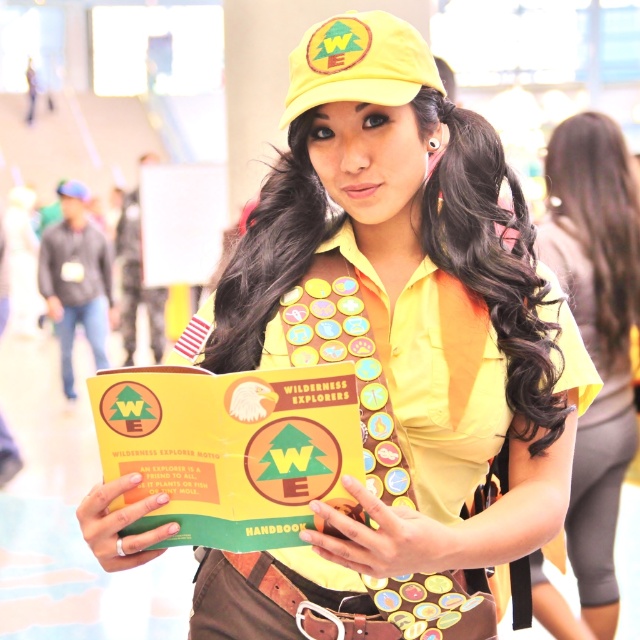
Based on the photo, measure the distance between yellow fabric cap at upper center and camera.

A distance of 2.72 meters exists between yellow fabric cap at upper center and camera.

Is yellow fabric cap at upper center above yellow fabric hat at upper center?

No, yellow fabric cap at upper center is not above yellow fabric hat at upper center.

This screenshot has height=640, width=640. Describe the element at coordinates (358, 64) in the screenshot. I see `yellow fabric cap at upper center` at that location.

This screenshot has height=640, width=640. What are the coordinates of `yellow fabric cap at upper center` in the screenshot? It's located at (358, 64).

Can you confirm if yellow matte shirt at center is wider than yellow fabric hat at upper center?

Yes, yellow matte shirt at center is wider than yellow fabric hat at upper center.

Image resolution: width=640 pixels, height=640 pixels. Identify the location of yellow matte shirt at center. (593, 353).

Find the location of `yellow matte shirt at center`. yellow matte shirt at center is located at coordinates (593, 353).

Is yellow matte handbook at center wider than yellow fabric cap at upper center?

Yes, yellow matte handbook at center is wider than yellow fabric cap at upper center.

Is point (276, 496) more distant than point (364, 74)?

No, it is in front of (364, 74).

Is point (164, 468) positioned in front of point (372, 24)?

Yes, it is in front of point (372, 24).

Find the location of `yellow matte handbook at center`. yellow matte handbook at center is located at coordinates (230, 449).